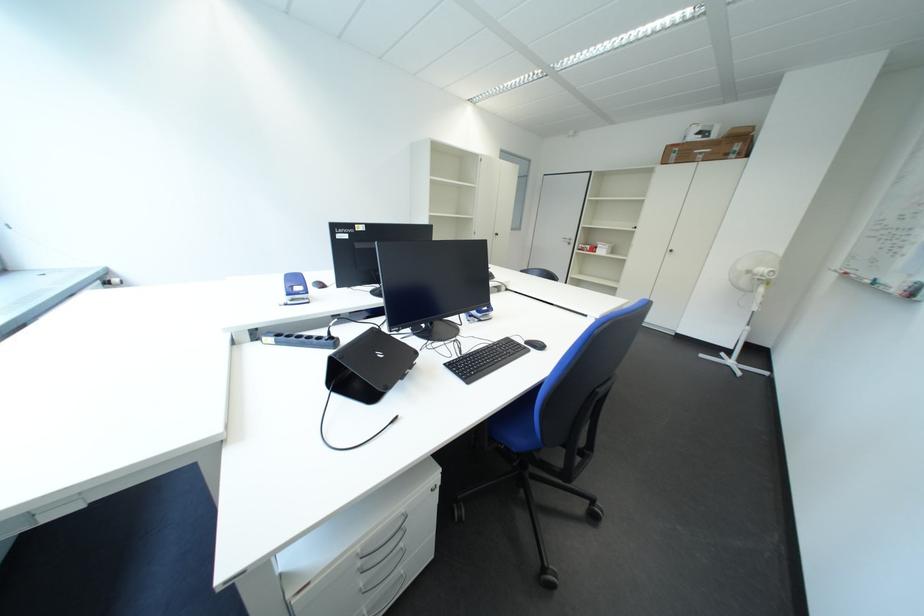
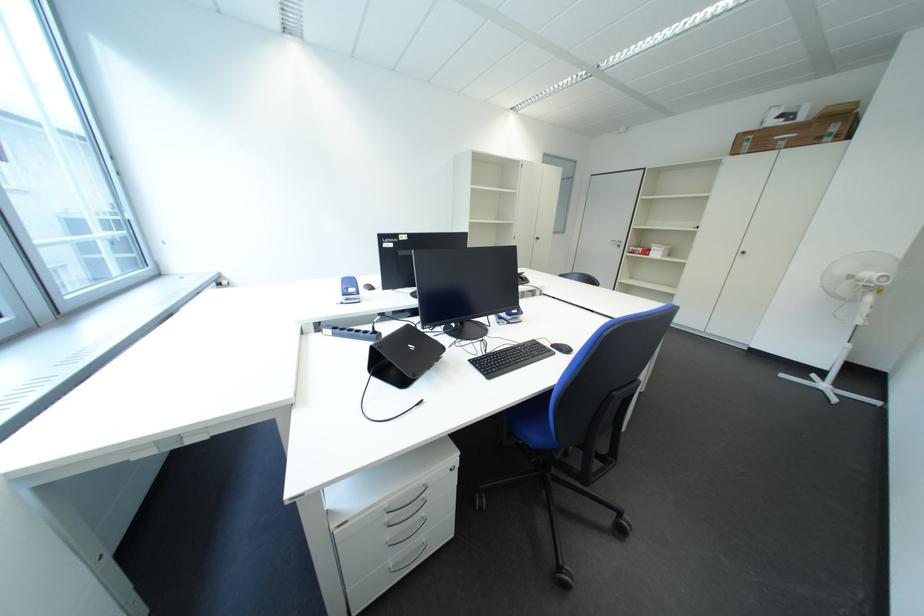
Which direction would the cameraman need to move to produce the second image?

The cameraman moved toward right, backward.